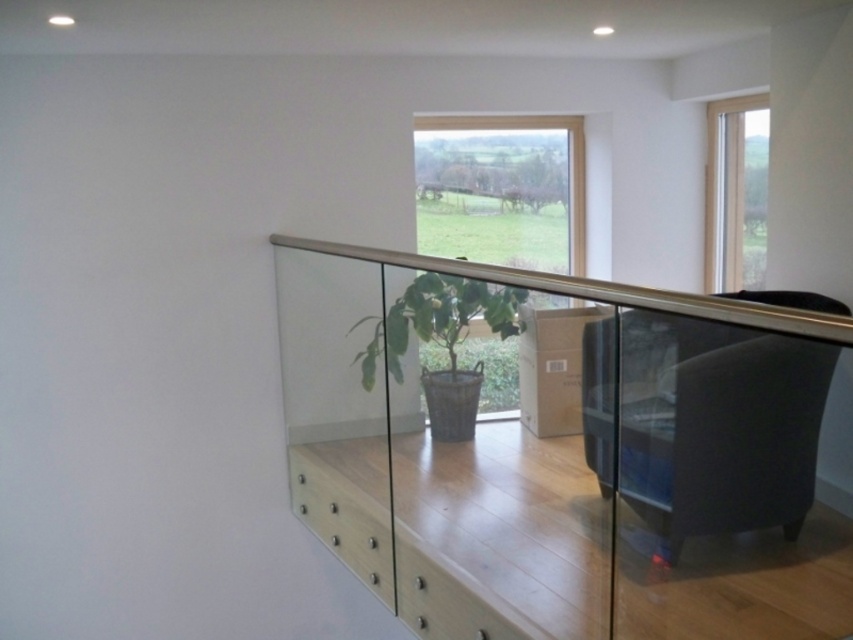
Question: Does green matte plant at center appear under wooden frame at upper right?

Choices:
 (A) no
 (B) yes

Answer: (B)

Question: Among these objects, which one is nearest to the camera?

Choices:
 (A) black leather chair at right
 (B) transparent glass cabinet at center
 (C) clear glass window at center

Answer: (B)

Question: Which point is farther from the camera taking this photo?

Choices:
 (A) (778, 536)
 (B) (469, 301)
 (C) (589, 371)

Answer: (B)

Question: Is transparent glass cabinet at center further to camera compared to black leather chair at right?

Choices:
 (A) no
 (B) yes

Answer: (A)

Question: Which of the following is the closest to the observer?

Choices:
 (A) (366, 346)
 (B) (729, 120)

Answer: (A)

Question: From the image, what is the correct spatial relationship of wooden frame at upper right in relation to clear glass window at center?

Choices:
 (A) right
 (B) left

Answer: (A)